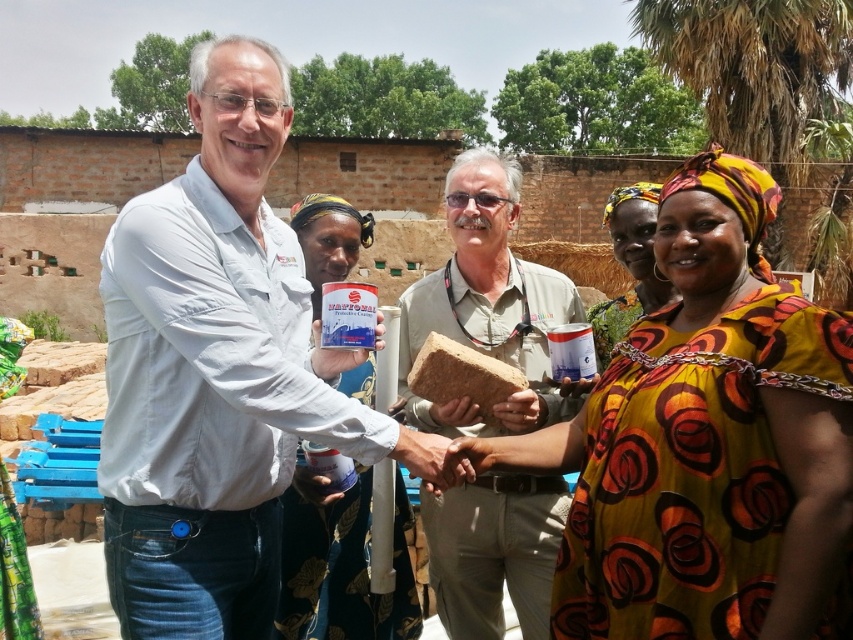
Is white matte shirt at center to the right of matte plastic container at center from the viewer's perspective?

In fact, white matte shirt at center is to the left of matte plastic container at center.

Does white matte shirt at center come in front of matte plastic container at center?

Yes.

Consider the image. Who is more distant from viewer, [234,451] or [364,556]?

The point [364,556] is more distant.

This screenshot has height=640, width=853. In order to click on white matte shirt at center in this screenshot , I will do `click(213, 371)`.

Is white matte shirt at center thinner than smooth skin hand at center?

No, white matte shirt at center is not thinner than smooth skin hand at center.

Does white matte shirt at center appear over smooth skin hand at center?

Answer: Indeed, white matte shirt at center is positioned over smooth skin hand at center.

Who is more forward, (376, 337) or (463, 458)?

Point (463, 458) is in front.

Find the location of a particular element. The image size is (853, 640). white matte shirt at center is located at coordinates pyautogui.click(x=213, y=371).

Which is more to the left, yellow printed fabric at center or beige fabric shirt at center?

From the viewer's perspective, beige fabric shirt at center appears more on the left side.

Does yellow printed fabric at center appear over beige fabric shirt at center?

Incorrect, yellow printed fabric at center is not positioned above beige fabric shirt at center.

Where is `yellow printed fabric at center`? This screenshot has width=853, height=640. yellow printed fabric at center is located at coordinates (706, 444).